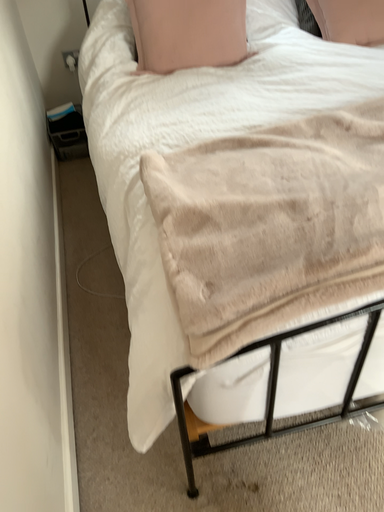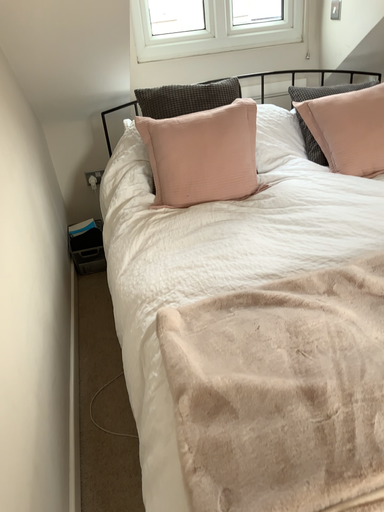
Question: Which way did the camera rotate in the video?

Choices:
 (A) rotated downward
 (B) rotated upward

Answer: (B)